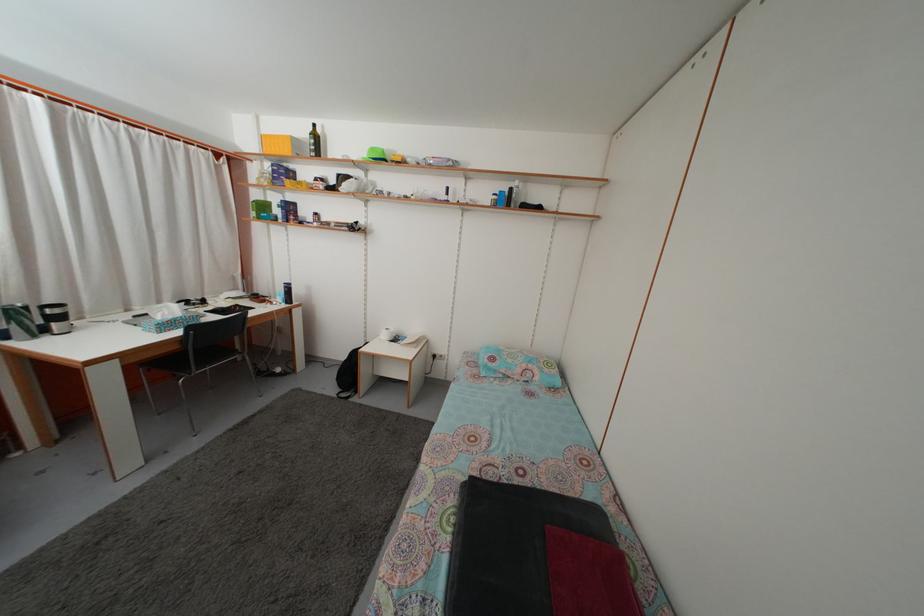
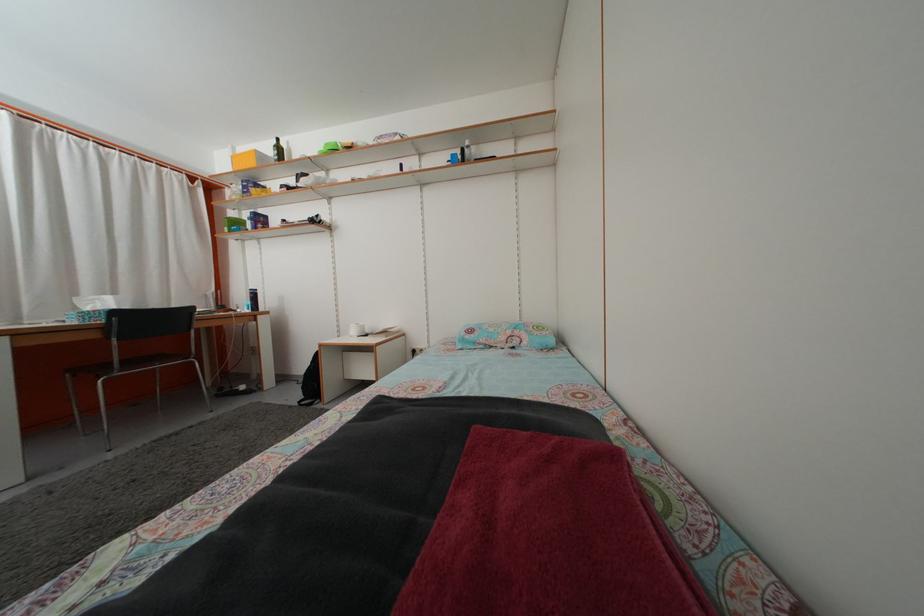
In the second image, find the point that corresponds to point (263, 124) in the first image.

(239, 156)